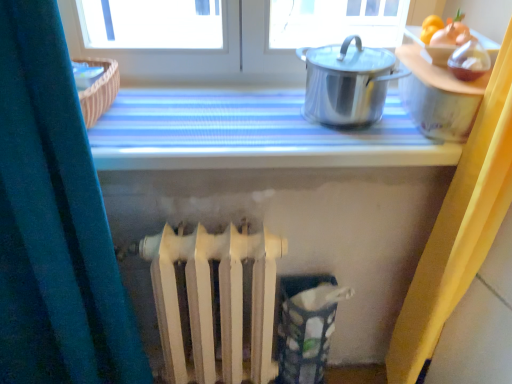
At what (x,y) coordinates should I click in order to perform the action: click on metallic silver pot at upper right. Please return your answer as a coordinate pair (x, y). Image resolution: width=512 pixels, height=384 pixels. Looking at the image, I should click on (250, 134).

Is polished stainless steel pot at upper right located outside metallic silver pot at upper right?

Yes, polished stainless steel pot at upper right is outside of metallic silver pot at upper right.

How distant is polished stainless steel pot at upper right from metallic silver pot at upper right?

polished stainless steel pot at upper right is 6.81 inches from metallic silver pot at upper right.

Considering the relative sizes of polished stainless steel pot at upper right and metallic silver pot at upper right in the image provided, is polished stainless steel pot at upper right wider than metallic silver pot at upper right?

No, polished stainless steel pot at upper right is not wider than metallic silver pot at upper right.

Is white matte radiator at center aimed at metallic silver pot at upper right?

No, white matte radiator at center is not aimed at metallic silver pot at upper right.

In the scene shown: Is white matte radiator at center closer to camera compared to metallic silver pot at upper right?

Yes, it is in front of metallic silver pot at upper right.

Which is less distant, (221, 251) or (267, 160)?

The point (267, 160) is closer to the camera.

What are the coordinates of `counter top located on the right of white matte radiator at center` in the screenshot? It's located at (250, 134).

Which object is positioned more to the left, metallic silver pot at upper right or white matte radiator at center?

From the viewer's perspective, white matte radiator at center appears more on the left side.

Which is behind, point (167, 90) or point (230, 299)?

The point (167, 90) is farther.

Where is `radiator located underneath the metallic silver pot at upper right (from a real-world perspective)`? This screenshot has height=384, width=512. radiator located underneath the metallic silver pot at upper right (from a real-world perspective) is located at coordinates pos(211,301).

Is metallic silver pot at upper right oriented away from white matte radiator at center?

No, metallic silver pot at upper right's orientation is not away from white matte radiator at center.

Does metallic silver pot at upper right touch polished stainless steel pot at upper right?

There is a gap between metallic silver pot at upper right and polished stainless steel pot at upper right.

Does metallic silver pot at upper right turn towards polished stainless steel pot at upper right?

No, metallic silver pot at upper right does not turn towards polished stainless steel pot at upper right.

In the image, is metallic silver pot at upper right positioned in front of or behind polished stainless steel pot at upper right?

In the image, metallic silver pot at upper right appears behind polished stainless steel pot at upper right.

From a real-world perspective, who is located higher, metallic silver pot at upper right or polished stainless steel pot at upper right?

polished stainless steel pot at upper right is physically above.

Is polished stainless steel pot at upper right directly adjacent to white matte radiator at center?

There is a gap between polished stainless steel pot at upper right and white matte radiator at center.

Can you confirm if polished stainless steel pot at upper right is thinner than white matte radiator at center?

In fact, polished stainless steel pot at upper right might be wider than white matte radiator at center.

Considering the positions of point (344, 45) and point (204, 351), is point (344, 45) closer or farther from the camera than point (204, 351)?

Point (344, 45).

From the picture: Is polished stainless steel pot at upper right inside or outside of white matte radiator at center?

polished stainless steel pot at upper right is not inside white matte radiator at center, it's outside.

Can you confirm if white matte radiator at center is taller than polished stainless steel pot at upper right?

Indeed, white matte radiator at center has a greater height compared to polished stainless steel pot at upper right.

Does point (162, 330) lie in front of point (367, 73)?

That is False.

How different are the orientations of white matte radiator at center and polished stainless steel pot at upper right in degrees?

The facing directions of white matte radiator at center and polished stainless steel pot at upper right are 2.94 degrees apart.

The image size is (512, 384). What are the coordinates of `kitchen appliance above the metallic silver pot at upper right (from a real-world perspective)` in the screenshot? It's located at (347, 82).

Where is `counter top lying on the right of white matte radiator at center`? counter top lying on the right of white matte radiator at center is located at coordinates (250, 134).

Based on their spatial positions, is polished stainless steel pot at upper right or metallic silver pot at upper right further from white matte radiator at center?

polished stainless steel pot at upper right.

Considering their positions, is metallic silver pot at upper right positioned further to white matte radiator at center than polished stainless steel pot at upper right?

Based on the image, polished stainless steel pot at upper right appears to be further to white matte radiator at center.

When comparing their distances from polished stainless steel pot at upper right, does metallic silver pot at upper right or white matte radiator at center seem closer?

Based on the image, metallic silver pot at upper right appears to be nearer to polished stainless steel pot at upper right.

From the image, which object appears to be farther from polished stainless steel pot at upper right, white matte radiator at center or metallic silver pot at upper right?

white matte radiator at center is further to polished stainless steel pot at upper right.

Estimate the real-world distances between objects in this image. Which object is closer to metallic silver pot at upper right, polished stainless steel pot at upper right or white matte radiator at center?

Among the two, polished stainless steel pot at upper right is located nearer to metallic silver pot at upper right.

Based on their spatial positions, is white matte radiator at center or polished stainless steel pot at upper right closer to metallic silver pot at upper right?

Based on the image, polished stainless steel pot at upper right appears to be nearer to metallic silver pot at upper right.

Identify the location of counter top that lies between polished stainless steel pot at upper right and white matte radiator at center from top to bottom. The height and width of the screenshot is (384, 512). (250, 134).